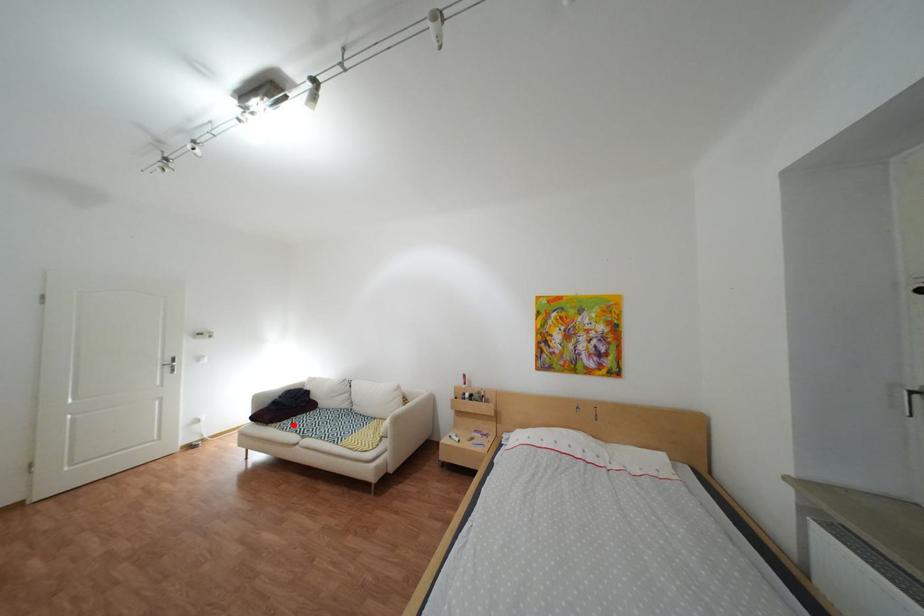
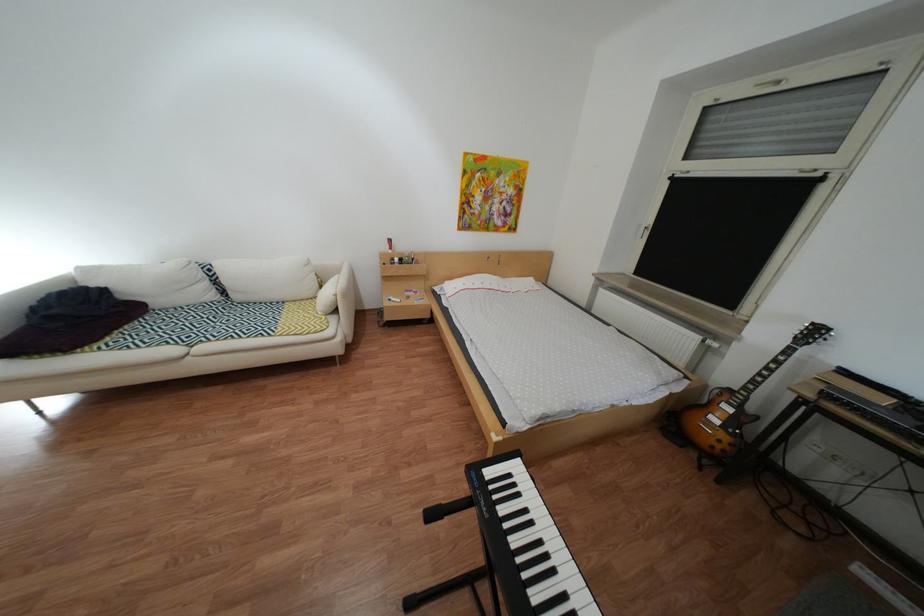
Question: I am providing you with two images of the same scene from different viewpoints. In image1, a red point is highlighted. Considering the same 3D point in image2, which of the following is correct?

Choices:
 (A) It is closer
 (B) It is farther

Answer: (A)